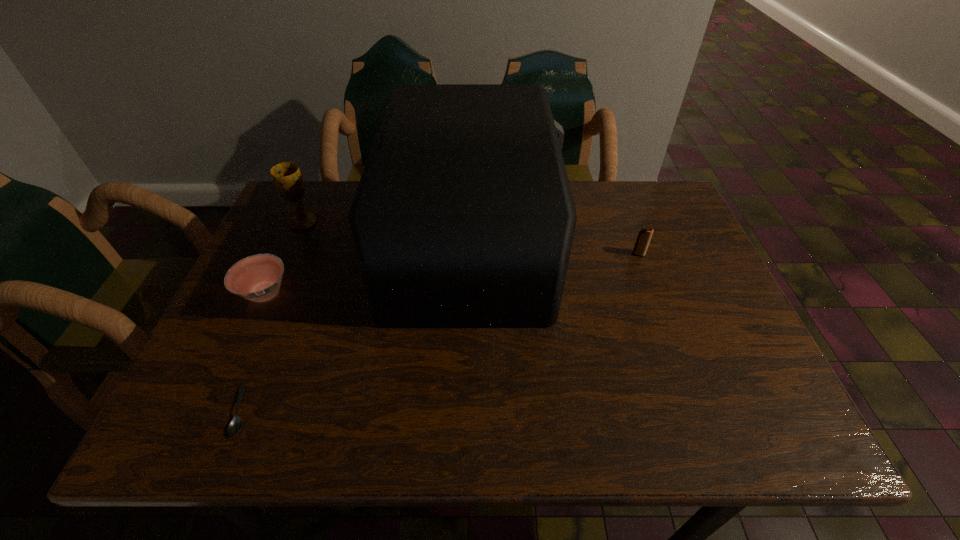
Locate an element on the screen. vacant area that lies between the nearest object and the fourth tallest object is located at coordinates (252, 352).

The height and width of the screenshot is (540, 960). In order to click on object that stands as the third closest to the fourth shortest object in this screenshot , I will do `click(235, 425)`.

Point out which object is positioned as the fourth nearest to the second tallest object. Please provide its 2D coordinates. Your answer should be formatted as a tuple, i.e. [(x, y)], where the tuple contains the x and y coordinates of a point satisfying the conditions above.

[(644, 236)]

Where is `vacant point that satisfies the following two spatial constraints: 1. on the back side of the fourth tallest object; 2. on the left side of the chalice`? The width and height of the screenshot is (960, 540). vacant point that satisfies the following two spatial constraints: 1. on the back side of the fourth tallest object; 2. on the left side of the chalice is located at coordinates (297, 222).

Identify the location of free region that satisfies the following two spatial constraints: 1. on the front side of the soupspoon; 2. on the left side of the fourth shortest object. (222, 410).

Identify the location of free location that satisfies the following two spatial constraints: 1. on the back side of the nearest object; 2. on the right side of the igniter. (304, 254).

Where is `vacant space that satisfies the following two spatial constraints: 1. on the front-facing side of the tallest object; 2. on the back side of the third tallest object`? vacant space that satisfies the following two spatial constraints: 1. on the front-facing side of the tallest object; 2. on the back side of the third tallest object is located at coordinates (472, 254).